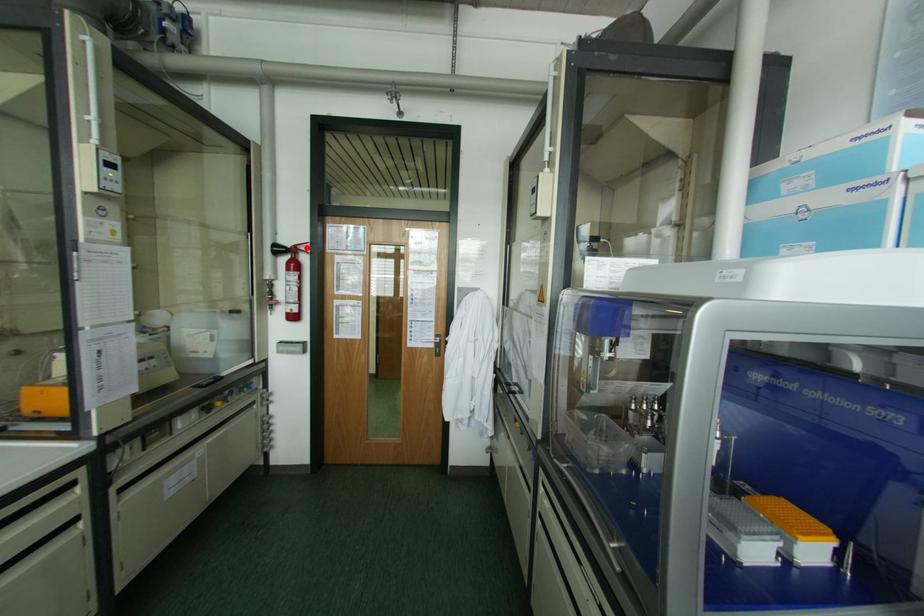
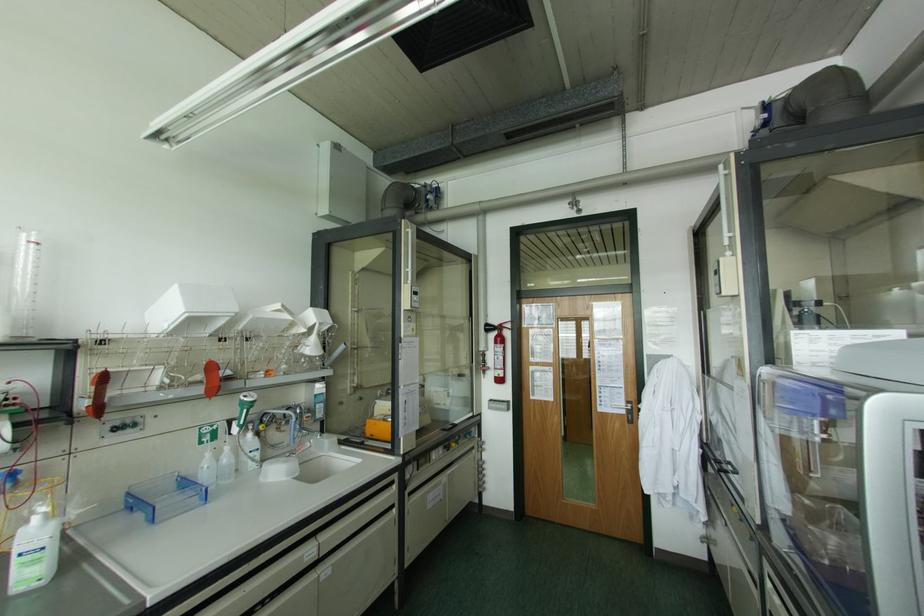
In the second image, find the point that corresponds to the highlighted location in the first image.

(507, 325)